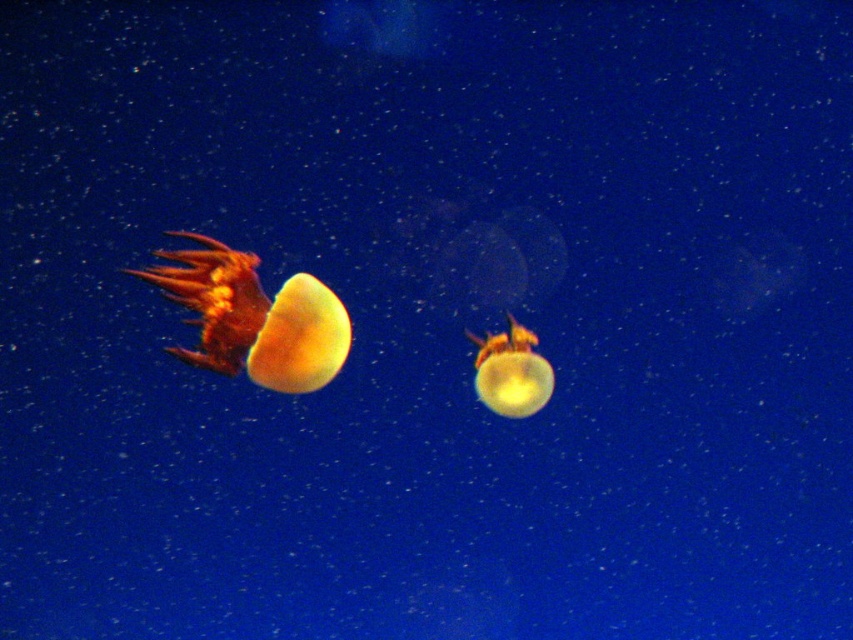
Question: In this image, where is translucent orange jellyfish at left located relative to translucent yellow jellyfish at center?

Choices:
 (A) left
 (B) right

Answer: (A)

Question: Which point is farther to the camera?

Choices:
 (A) translucent yellow jellyfish at center
 (B) translucent orange jellyfish at left

Answer: (A)

Question: Does translucent orange jellyfish at left appear over translucent yellow jellyfish at center?

Choices:
 (A) no
 (B) yes

Answer: (B)

Question: From the image, what is the correct spatial relationship of translucent orange jellyfish at left in relation to translucent yellow jellyfish at center?

Choices:
 (A) below
 (B) above

Answer: (B)